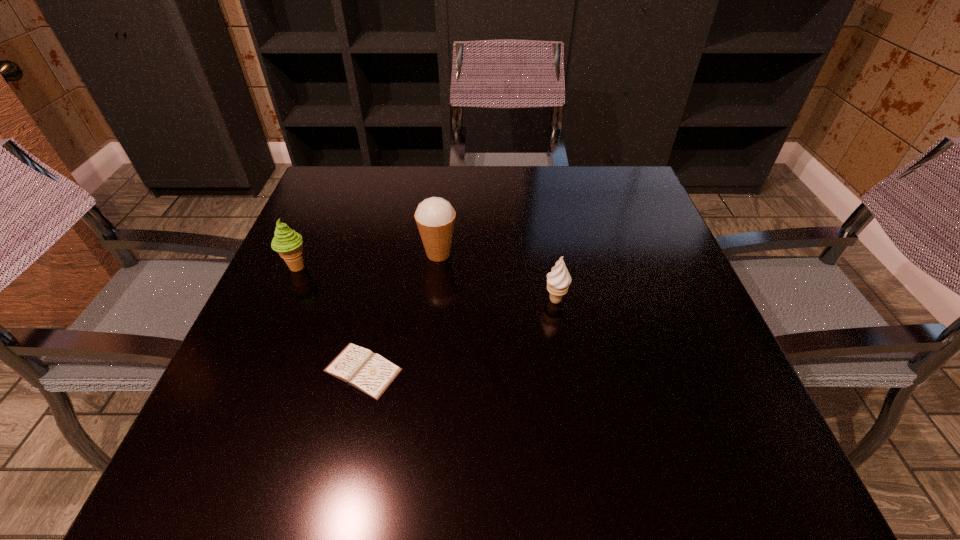
The image size is (960, 540). In order to click on vacant area that satisfies the following two spatial constraints: 1. on the front side of the diary; 2. on the right side of the leftmost object in this screenshot , I will do `click(252, 370)`.

Locate an element on the screen. free spot that satisfies the following two spatial constraints: 1. on the back side of the second icecream from right to left; 2. on the left side of the leftmost object is located at coordinates (302, 254).